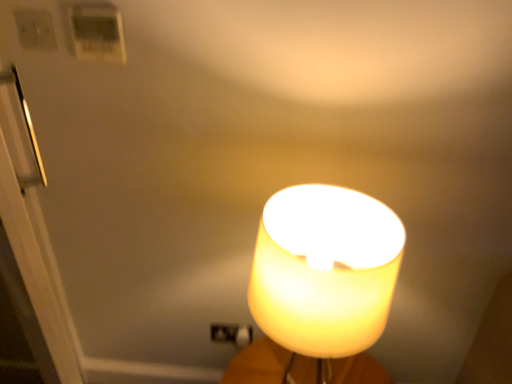
How much space does white plastic thermostat at upper left, arranged as the first light switch when viewed from the right, occupy vertically?

The height of white plastic thermostat at upper left, arranged as the first light switch when viewed from the right, is 5.75 inches.

Locate an element on the screen. The image size is (512, 384). white plastic thermostat at upper left, the second light switch in the left-to-right sequence is located at coordinates (97, 33).

Based on the photo, how distant is white glossy door at left from translucent yellow lampshade at center?

white glossy door at left and translucent yellow lampshade at center are 22.93 inches apart from each other.

What's the angular difference between white glossy door at left and translucent yellow lampshade at center's facing directions?

47.2 degrees.

Looking at their sizes, would you say white glossy door at left is wider or thinner than translucent yellow lampshade at center?

Considering their sizes, white glossy door at left looks slimmer than translucent yellow lampshade at center.

Which of these two, white glossy door at left or translucent yellow lampshade at center, stands taller?

white glossy door at left is taller.

Is white plastic light switch at upper left, the 1th light switch positioned from the left, smaller than white glossy door at left?

Yes, white plastic light switch at upper left, the 1th light switch positioned from the left, is smaller than white glossy door at left.

Would you say white plastic light switch at upper left, the 1th light switch positioned from the left, is inside or outside white glossy door at left?

white plastic light switch at upper left, the 1th light switch positioned from the left, exists outside the volume of white glossy door at left.

Could you tell me if white plastic light switch at upper left, the 1th light switch positioned from the left, is facing white glossy door at left?

No, white plastic light switch at upper left, the 1th light switch positioned from the left, is not turned towards white glossy door at left.

How different are the orientations of white plastic light switch at upper left, placed as the 2th light switch when sorted from right to left, and white glossy door at left in degrees?

The facing directions of white plastic light switch at upper left, placed as the 2th light switch when sorted from right to left, and white glossy door at left are 40.2 degrees apart.

Are white glossy door at left and white plastic light switch at upper left, the 1th light switch positioned from the left, making contact?

white glossy door at left and white plastic light switch at upper left, the 1th light switch positioned from the left, are clearly separated.

From a real-world perspective, between white glossy door at left and white plastic light switch at upper left, the 1th light switch positioned from the left, who is vertically lower?

white glossy door at left.

Considering the sizes of white glossy door at left and white plastic light switch at upper left, the 1th light switch positioned from the left, in the image, is white glossy door at left bigger or smaller than white plastic light switch at upper left, the 1th light switch positioned from the left,?

Considering their sizes, white glossy door at left takes up more space than white plastic light switch at upper left, the 1th light switch positioned from the left.

Considering the sizes of translucent yellow lampshade at center and white glossy door at left in the image, is translucent yellow lampshade at center wider or thinner than white glossy door at left?

Clearly, translucent yellow lampshade at center has more width compared to white glossy door at left.

From a real-world perspective, relative to white glossy door at left, is translucent yellow lampshade at center vertically above or below?

Clearly, from a real-world perspective, translucent yellow lampshade at center is above white glossy door at left.

From the image's perspective, which is above, translucent yellow lampshade at center or white glossy door at left?

translucent yellow lampshade at center.

At what (x,y) coordinates should I click in order to perform the action: click on door that is below the translucent yellow lampshade at center (from the image's perspective). Please return your answer as a coordinate pair (x, y). Looking at the image, I should click on (29, 240).

Does white glossy door at left have a smaller size compared to white plastic thermostat at upper left, the second light switch in the left-to-right sequence?

Incorrect, white glossy door at left is not smaller in size than white plastic thermostat at upper left, the second light switch in the left-to-right sequence.

Based on their positions, is white glossy door at left located to the left or right of white plastic thermostat at upper left, the second light switch in the left-to-right sequence?

In the image, white glossy door at left appears on the left side of white plastic thermostat at upper left, the second light switch in the left-to-right sequence.

How far apart are white glossy door at left and white plastic thermostat at upper left, the second light switch in the left-to-right sequence?

white glossy door at left is 41.50 centimeters from white plastic thermostat at upper left, the second light switch in the left-to-right sequence.

Is point (7, 199) more distant than point (98, 26)?

That is False.

From the image's perspective, is white plastic light switch at upper left, placed as the 2th light switch when sorted from right to left, positioned above or below white plastic thermostat at upper left, the second light switch in the left-to-right sequence?

white plastic light switch at upper left, placed as the 2th light switch when sorted from right to left, is situated higher than white plastic thermostat at upper left, the second light switch in the left-to-right sequence, in the image.

Consider the image. Is white plastic light switch at upper left, the 1th light switch positioned from the left, shorter than white plastic thermostat at upper left, the second light switch in the left-to-right sequence?

Yes.

Who is more distant, white plastic light switch at upper left, placed as the 2th light switch when sorted from right to left, or white plastic thermostat at upper left, arranged as the first light switch when viewed from the right?

white plastic light switch at upper left, placed as the 2th light switch when sorted from right to left, is more distant.

Does white plastic light switch at upper left, placed as the 2th light switch when sorted from right to left, have a greater width compared to white plastic thermostat at upper left, the second light switch in the left-to-right sequence?

In fact, white plastic light switch at upper left, placed as the 2th light switch when sorted from right to left, might be narrower than white plastic thermostat at upper left, the second light switch in the left-to-right sequence.

Could you tell me if translucent yellow lampshade at center is facing white plastic light switch at upper left, placed as the 2th light switch when sorted from right to left?

No, translucent yellow lampshade at center is not facing towards white plastic light switch at upper left, placed as the 2th light switch when sorted from right to left.

Considering the relative positions of translucent yellow lampshade at center and white plastic light switch at upper left, placed as the 2th light switch when sorted from right to left, in the image provided, is translucent yellow lampshade at center to the right of white plastic light switch at upper left, placed as the 2th light switch when sorted from right to left, from the viewer's perspective?

Yes, translucent yellow lampshade at center is to the right of white plastic light switch at upper left, placed as the 2th light switch when sorted from right to left.

From a real-world perspective, does translucent yellow lampshade at center stand above white plastic light switch at upper left, placed as the 2th light switch when sorted from right to left?

No, from a real-world perspective, translucent yellow lampshade at center is not over white plastic light switch at upper left, placed as the 2th light switch when sorted from right to left

From the image's perspective, starting from the translucent yellow lampshade at center, which light switch is the 2nd one above? Please provide its 2D coordinates.

[(35, 29)]

Identify the location of door on the left of the translucent yellow lampshade at center. (29, 240).

I want to click on the 2nd light switch behind when counting from the white glossy door at left, so click(35, 29).

Looking at the image, which one is located closer to white plastic thermostat at upper left, the second light switch in the left-to-right sequence, white plastic light switch at upper left, placed as the 2th light switch when sorted from right to left, or white glossy door at left?

The object closer to white plastic thermostat at upper left, the second light switch in the left-to-right sequence, is white plastic light switch at upper left, placed as the 2th light switch when sorted from right to left.

Based on their spatial positions, is white glossy door at left or translucent yellow lampshade at center further from white plastic light switch at upper left, placed as the 2th light switch when sorted from right to left?

translucent yellow lampshade at center is further to white plastic light switch at upper left, placed as the 2th light switch when sorted from right to left.

Looking at the image, which one is located further to white glossy door at left, translucent yellow lampshade at center or white plastic thermostat at upper left, the second light switch in the left-to-right sequence?

translucent yellow lampshade at center is positioned further to the anchor white glossy door at left.

When comparing their distances from white glossy door at left, does white plastic thermostat at upper left, arranged as the first light switch when viewed from the right, or translucent yellow lampshade at center seem further?

translucent yellow lampshade at center is further to white glossy door at left.

Looking at the image, which one is located closer to white glossy door at left, white plastic light switch at upper left, placed as the 2th light switch when sorted from right to left, or white plastic thermostat at upper left, the second light switch in the left-to-right sequence?

Based on the image, white plastic thermostat at upper left, the second light switch in the left-to-right sequence, appears to be nearer to white glossy door at left.

Estimate the real-world distances between objects in this image. Which object is further from translucent yellow lampshade at center, white glossy door at left or white plastic light switch at upper left, the 1th light switch positioned from the left?

Among the two, white plastic light switch at upper left, the 1th light switch positioned from the left, is located further to translucent yellow lampshade at center.

Looking at the image, which one is located closer to white glossy door at left, translucent yellow lampshade at center or white plastic light switch at upper left, placed as the 2th light switch when sorted from right to left?

white plastic light switch at upper left, placed as the 2th light switch when sorted from right to left, is positioned closer to the anchor white glossy door at left.

Looking at the image, which one is located closer to translucent yellow lampshade at center, white glossy door at left or white plastic thermostat at upper left, arranged as the first light switch when viewed from the right?

white glossy door at left is closer to translucent yellow lampshade at center.

At what (x,y) coordinates should I click in order to perform the action: click on light switch between white plastic light switch at upper left, placed as the 2th light switch when sorted from right to left, and translucent yellow lampshade at center, in the vertical direction. Please return your answer as a coordinate pair (x, y). Image resolution: width=512 pixels, height=384 pixels. Looking at the image, I should click on (97, 33).

At what (x,y) coordinates should I click in order to perform the action: click on light switch between white plastic light switch at upper left, placed as the 2th light switch when sorted from right to left, and white glossy door at left, in the vertical direction. Please return your answer as a coordinate pair (x, y). Image resolution: width=512 pixels, height=384 pixels. Looking at the image, I should click on (97, 33).

Where is `lamp between white plastic thermostat at upper left, the second light switch in the left-to-right sequence, and white glossy door at left from top to bottom`? lamp between white plastic thermostat at upper left, the second light switch in the left-to-right sequence, and white glossy door at left from top to bottom is located at coordinates (325, 270).